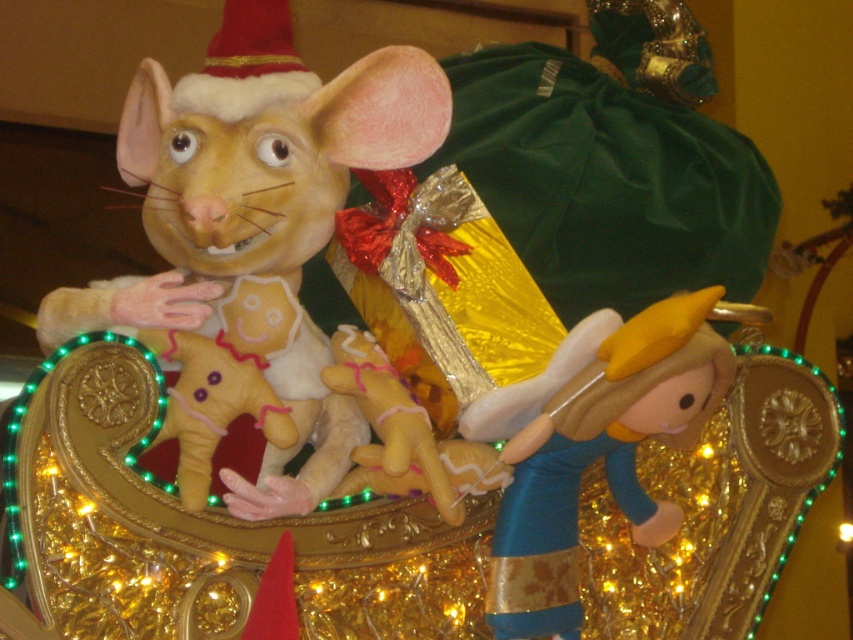
Question: Among these objects, which one is farthest from the camera?

Choices:
 (A) soft plush gingerbread man at center
 (B) velvet blue plush at right

Answer: (B)

Question: Which of the following is the closest to the observer?

Choices:
 (A) soft plush gingerbread man at center
 (B) velvet blue plush at right

Answer: (A)

Question: Which point is closer to the camera taking this photo?

Choices:
 (A) (151, 67)
 (B) (207, 356)

Answer: (B)

Question: From the image, what is the correct spatial relationship of matte yellow plush mouse at center in relation to velvet blue plush at right?

Choices:
 (A) below
 (B) above

Answer: (B)

Question: Observing the image, what is the correct spatial positioning of matte yellow plush mouse at center in reference to velvet blue plush at right?

Choices:
 (A) right
 (B) left

Answer: (B)

Question: Does matte yellow plush mouse at center appear on the right side of soft plush gingerbread man at center?

Choices:
 (A) no
 (B) yes

Answer: (B)